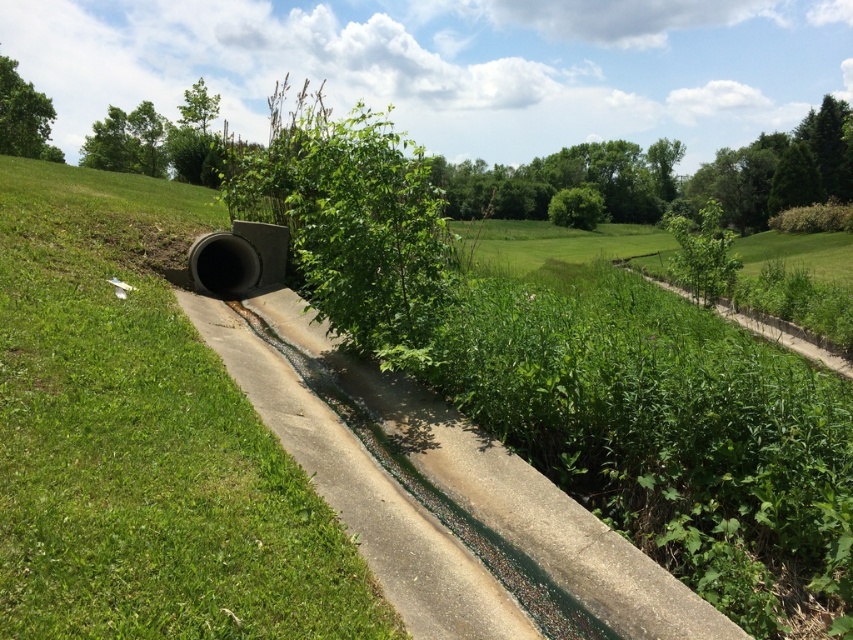
You are a gardener who wants to plant a new shrub in the drainage area. You have two options for locations based on the image provided. The first option is near the green grass at center, and the second is near the green leafy plant at upper right. Which location would provide more space for the shrub to grow, and why?

The green leafy plant at upper right is larger in size compared to the green grass at center, so planting the shrub near the green leafy plant at upper right would provide more space for growth.

You are standing at the edge of the drainage channel and want to place a sensor at the two points labeled point (93, 262) and point (306, 150). Which point is closer to you?

Point (93, 262) is closer to the viewer than point (306, 150), so the sensor placed at point (93, 262) will be closer to you.